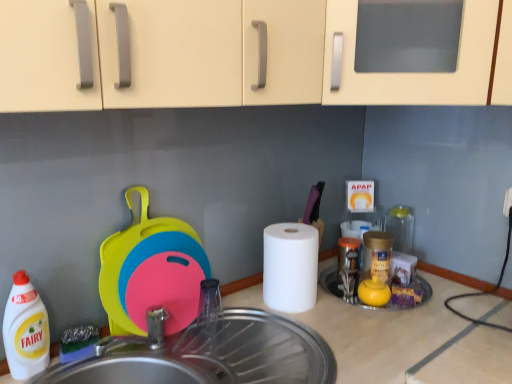
Where is `white matte paper towel at center`? white matte paper towel at center is located at coordinates (290, 267).

The image size is (512, 384). Find the location of `metallic stainless steel sink at lower center`. metallic stainless steel sink at lower center is located at coordinates (211, 356).

Image resolution: width=512 pixels, height=384 pixels. What do you see at coordinates (151, 272) in the screenshot?
I see `rubberized plastic cutting boards at left` at bounding box center [151, 272].

Identify the location of white plastic bottle at left. The height and width of the screenshot is (384, 512). (25, 329).

Could you measure the distance between metallic stainless steel sink at lower center and white matte paper towel at center?

A distance of 23.22 centimeters exists between metallic stainless steel sink at lower center and white matte paper towel at center.

Is metallic stainless steel sink at lower center aimed at white matte paper towel at center?

No, metallic stainless steel sink at lower center is not facing towards white matte paper towel at center.

Based on the photo, can you tell me how much metallic stainless steel sink at lower center and white matte paper towel at center differ in facing direction?

1.01 degrees.

Between metallic stainless steel sink at lower center and white matte paper towel at center, which one appears on the right side from the viewer's perspective?

white matte paper towel at center is more to the right.

Is rubberized plastic cutting boards at left completely or partially outside of white plastic bottle at left?

That's correct, rubberized plastic cutting boards at left is outside of white plastic bottle at left.

Is rubberized plastic cutting boards at left positioned with its back to white plastic bottle at left?

No, rubberized plastic cutting boards at left is not facing away from white plastic bottle at left.

In terms of width, does rubberized plastic cutting boards at left look wider or thinner when compared to white plastic bottle at left?

In the image, rubberized plastic cutting boards at left appears to be wider than white plastic bottle at left.

Does rubberized plastic cutting boards at left have a larger size compared to metallic stainless steel sink at lower center?

No.

Considering the positions of objects rubberized plastic cutting boards at left and metallic stainless steel sink at lower center in the image provided, who is more to the left, rubberized plastic cutting boards at left or metallic stainless steel sink at lower center?

rubberized plastic cutting boards at left is more to the left.

Does rubberized plastic cutting boards at left have a greater width compared to metallic stainless steel sink at lower center?

No, rubberized plastic cutting boards at left is not wider than metallic stainless steel sink at lower center.

Is white plastic bottle at left smaller than metallic stainless steel sink at lower center?

Indeed, white plastic bottle at left has a smaller size compared to metallic stainless steel sink at lower center.

How many degrees apart are the facing directions of white plastic bottle at left and metallic stainless steel sink at lower center?

The facing directions of white plastic bottle at left and metallic stainless steel sink at lower center are 0.0664 degrees apart.

From a real-world perspective, is white plastic bottle at left positioned above or below metallic stainless steel sink at lower center?

Clearly, from a real-world perspective, white plastic bottle at left is above metallic stainless steel sink at lower center.

In the scene shown: Considering the sizes of objects white plastic bottle at left and metallic stainless steel sink at lower center in the image provided, who is wider, white plastic bottle at left or metallic stainless steel sink at lower center?

With larger width is metallic stainless steel sink at lower center.

In terms of height, does metallic stainless steel sink at lower center look taller or shorter compared to white plastic bottle at left?

Considering their sizes, metallic stainless steel sink at lower center has less height than white plastic bottle at left.

Considering their positions, is metallic stainless steel sink at lower center located in front of or behind white plastic bottle at left?

Visually, metallic stainless steel sink at lower center is located in front of white plastic bottle at left.

Considering the points (156, 366) and (24, 374), which point is in front, point (156, 366) or point (24, 374)?

The point (24, 374) is in front.

Is metallic stainless steel sink at lower center to the left of white plastic bottle at left from the viewer's perspective?

In fact, metallic stainless steel sink at lower center is to the right of white plastic bottle at left.

From the image's perspective, relative to white plastic bottle at left, is white matte paper towel at center above or below?

From the image's perspective, white matte paper towel at center appears above white plastic bottle at left.

Does white matte paper towel at center turn towards white plastic bottle at left?

No, white matte paper towel at center is not facing towards white plastic bottle at left.

Which is in front, point (269, 266) or point (33, 363)?

The point (33, 363) is in front.

In order to click on sink on the left of white matte paper towel at center in this screenshot , I will do `click(211, 356)`.

Measure the distance from white matte paper towel at center to metallic stainless steel sink at lower center.

9.14 inches.

Would you consider white matte paper towel at center to be distant from metallic stainless steel sink at lower center?

white matte paper towel at center is actually quite close to metallic stainless steel sink at lower center.

Between white matte paper towel at center and metallic stainless steel sink at lower center, which one has more height?

With more height is white matte paper towel at center.

At what (x,y) coordinates should I click in order to perform the action: click on paper towel above the metallic stainless steel sink at lower center (from a real-world perspective). Please return your answer as a coordinate pair (x, y). Looking at the image, I should click on (290, 267).

This screenshot has width=512, height=384. Identify the location of appliance behind the white plastic bottle at left. (151, 272).

When comparing their distances from white matte paper towel at center, does white plastic bottle at left or rubberized plastic cutting boards at left seem closer?

rubberized plastic cutting boards at left is positioned closer to the anchor white matte paper towel at center.

Considering their positions, is white plastic bottle at left positioned further to metallic stainless steel sink at lower center than rubberized plastic cutting boards at left?

white plastic bottle at left is further to metallic stainless steel sink at lower center.

When comparing their distances from metallic stainless steel sink at lower center, does rubberized plastic cutting boards at left or white matte paper towel at center seem further?

white matte paper towel at center is further to metallic stainless steel sink at lower center.

Which object lies further to the anchor point white plastic bottle at left, metallic stainless steel sink at lower center or rubberized plastic cutting boards at left?

Based on the image, metallic stainless steel sink at lower center appears to be further to white plastic bottle at left.

Which object lies further to the anchor point white plastic bottle at left, white matte paper towel at center or metallic stainless steel sink at lower center?

white matte paper towel at center is positioned further to the anchor white plastic bottle at left.

Which object lies further to the anchor point metallic stainless steel sink at lower center, white matte paper towel at center or white plastic bottle at left?

white plastic bottle at left is positioned further to the anchor metallic stainless steel sink at lower center.

Based on their spatial positions, is metallic stainless steel sink at lower center or rubberized plastic cutting boards at left further from white matte paper towel at center?

The object further to white matte paper towel at center is rubberized plastic cutting boards at left.

Looking at the image, which one is located closer to rubberized plastic cutting boards at left, metallic stainless steel sink at lower center or white matte paper towel at center?

Based on the image, metallic stainless steel sink at lower center appears to be nearer to rubberized plastic cutting boards at left.

Identify the location of sink between white plastic bottle at left and white matte paper towel at center from left to right. (211, 356).

You are a GUI agent. You are given a task and a screenshot of the screen. Output one action in this format:
    pyautogui.click(x=<x>, y=<y>)
    Task: Click on the appliance between white plastic bottle at left and white matte paper towel at center from left to right
    Image resolution: width=512 pixels, height=384 pixels.
    Given the screenshot: What is the action you would take?
    pyautogui.click(x=151, y=272)

This screenshot has width=512, height=384. I want to click on cleaning product between metallic stainless steel sink at lower center and rubberized plastic cutting boards at left in the front-back direction, so click(x=25, y=329).

Where is `appliance located between metallic stainless steel sink at lower center and white matte paper towel at center in the depth direction`? appliance located between metallic stainless steel sink at lower center and white matte paper towel at center in the depth direction is located at coordinates (151, 272).